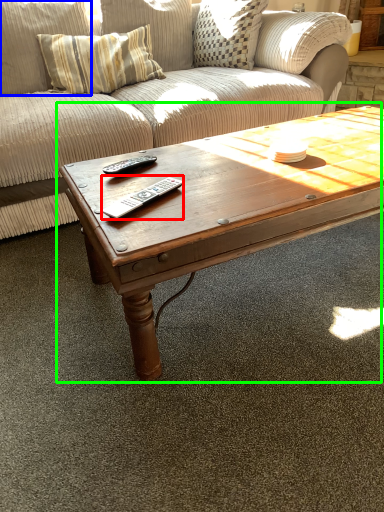
Question: Based on their relative distances, which object is farther from remote (highlighted by a red box)? Choose from pillow (highlighted by a blue box) and coffee table (highlighted by a green box).

Choices:
 (A) pillow
 (B) coffee table

Answer: (A)